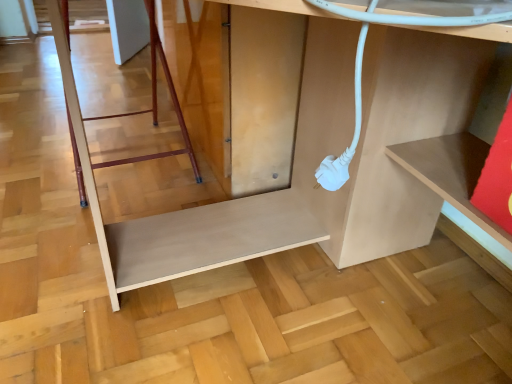
Question: From a real-world perspective, is wooden ladder at lower left positioned under matte white cable at lower center based on gravity?

Choices:
 (A) no
 (B) yes

Answer: (B)

Question: Is wooden ladder at lower left with matte white cable at lower center?

Choices:
 (A) no
 (B) yes

Answer: (A)

Question: Does wooden ladder at lower left have a greater width compared to matte white cable at lower center?

Choices:
 (A) yes
 (B) no

Answer: (B)

Question: From the image's perspective, does wooden ladder at lower left appear lower than matte white cable at lower center?

Choices:
 (A) yes
 (B) no

Answer: (B)

Question: Is wooden ladder at lower left closer to camera compared to matte white cable at lower center?

Choices:
 (A) no
 (B) yes

Answer: (A)

Question: Can you confirm if wooden ladder at lower left is positioned to the left of matte white cable at lower center?

Choices:
 (A) yes
 (B) no

Answer: (A)

Question: Does matte white cable at lower center have a lesser height compared to wooden ladder at lower left?

Choices:
 (A) yes
 (B) no

Answer: (B)

Question: Is matte white cable at lower center in contact with wooden ladder at lower left?

Choices:
 (A) yes
 (B) no

Answer: (B)

Question: From the image's perspective, is matte white cable at lower center located beneath wooden ladder at lower left?

Choices:
 (A) yes
 (B) no

Answer: (A)

Question: Is matte white cable at lower center further to the viewer compared to wooden ladder at lower left?

Choices:
 (A) yes
 (B) no

Answer: (B)

Question: Is matte white cable at lower center facing towards wooden ladder at lower left?

Choices:
 (A) no
 (B) yes

Answer: (A)

Question: From the image's perspective, does matte white cable at lower center appear higher than wooden ladder at lower left?

Choices:
 (A) yes
 (B) no

Answer: (B)

Question: In terms of height, does wooden ladder at lower left look taller or shorter compared to matte white cable at lower center?

Choices:
 (A) tall
 (B) short

Answer: (B)